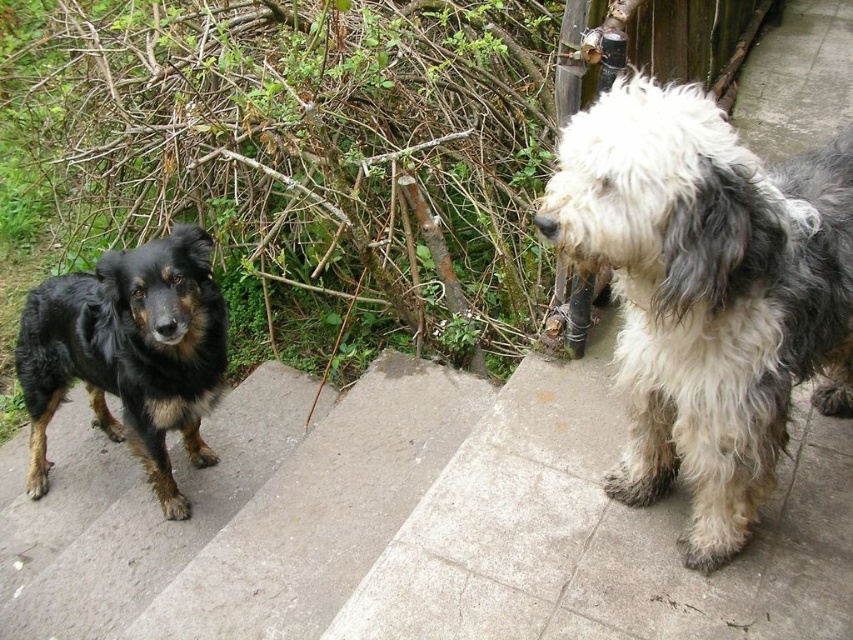
Is concrete stairs at lower left further to camera compared to shaggy black dog at left?

No, concrete stairs at lower left is in front of shaggy black dog at left.

Is point (7, 464) closer to viewer compared to point (102, 266)?

No, it is behind (102, 266).

Locate an element on the screen. This screenshot has width=853, height=640. concrete stairs at lower left is located at coordinates (247, 512).

Is white and gray fluffy dog at upper right smaller than shaggy black dog at left?

Indeed, white and gray fluffy dog at upper right has a smaller size compared to shaggy black dog at left.

Which is behind, point (689, 348) or point (136, 362)?

Point (136, 362)

Where is `white and gray fluffy dog at upper right`? This screenshot has width=853, height=640. white and gray fluffy dog at upper right is located at coordinates (706, 292).

Consider the image. Which is more to the right, white and gray fluffy dog at upper right or concrete stairs at lower left?

white and gray fluffy dog at upper right is more to the right.

Does point (704, 412) come closer to viewer compared to point (196, 625)?

Yes, point (704, 412) is closer to viewer.

The width and height of the screenshot is (853, 640). I want to click on white and gray fluffy dog at upper right, so click(706, 292).